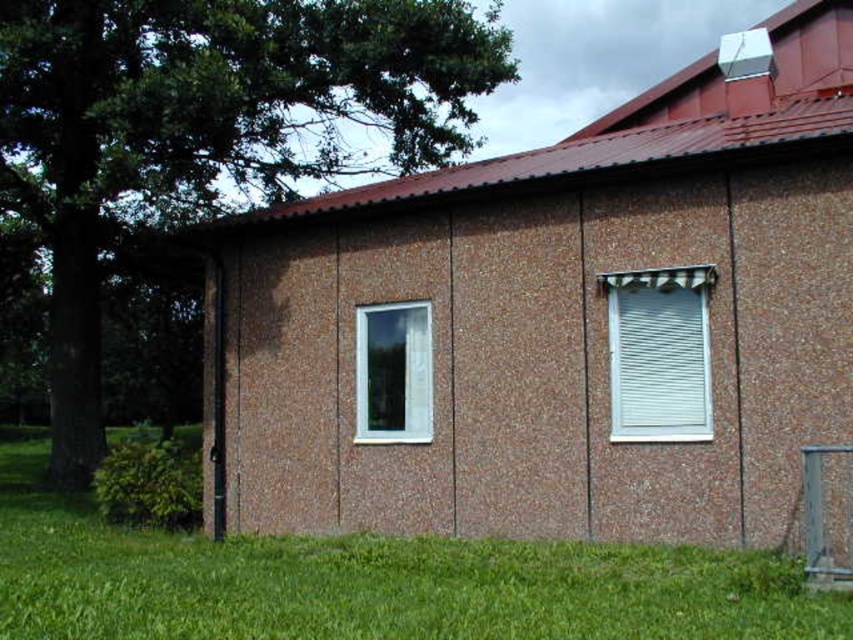
You are a painter standing at the front of the building. You need to paint the brown textured wall at center and the white textured blinds at right. Which object should you paint first if you want to start with the one that is more to the left?

The brown textured wall at center is positioned on the left side of white textured blinds at right, so you should paint the brown textured wall at center first since it is more to the left.

You are standing in front of the brown textured wall at center and want to place a 10 feet long ladder against it. Is there enough space between the wall and the nearest object to safely place the ladder?

The distance between the brown textured wall at center and the nearest object is 26.89 feet. Since the ladder is only 10 feet long, there is sufficient space to safely place it against the wall.